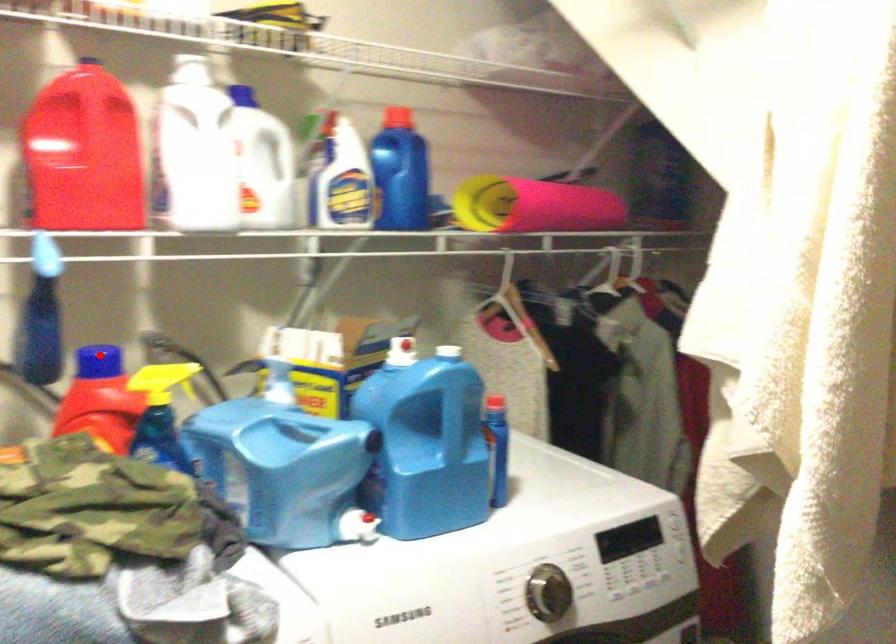
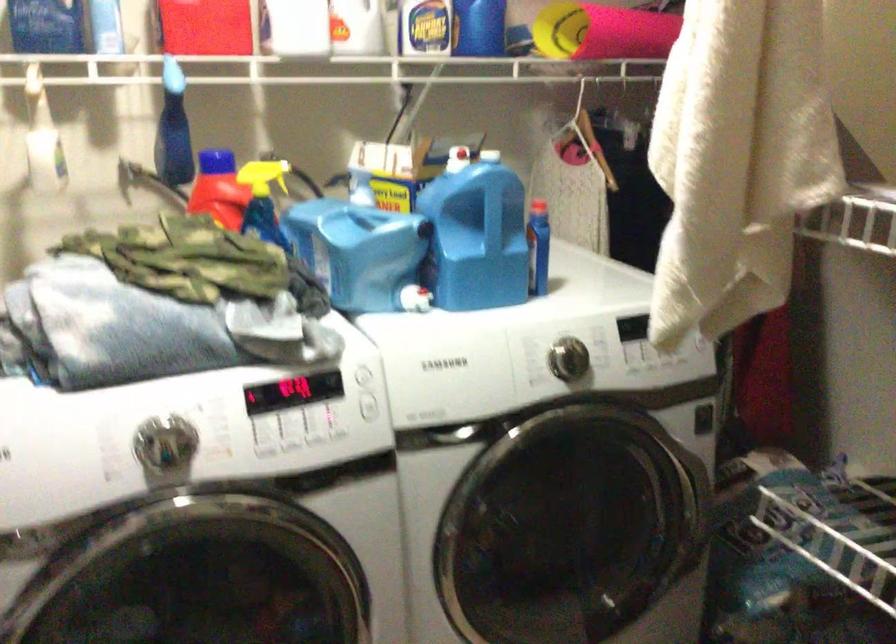
Locate, in the second image, the point that corresponds to the highlighted location in the first image.

(217, 160)